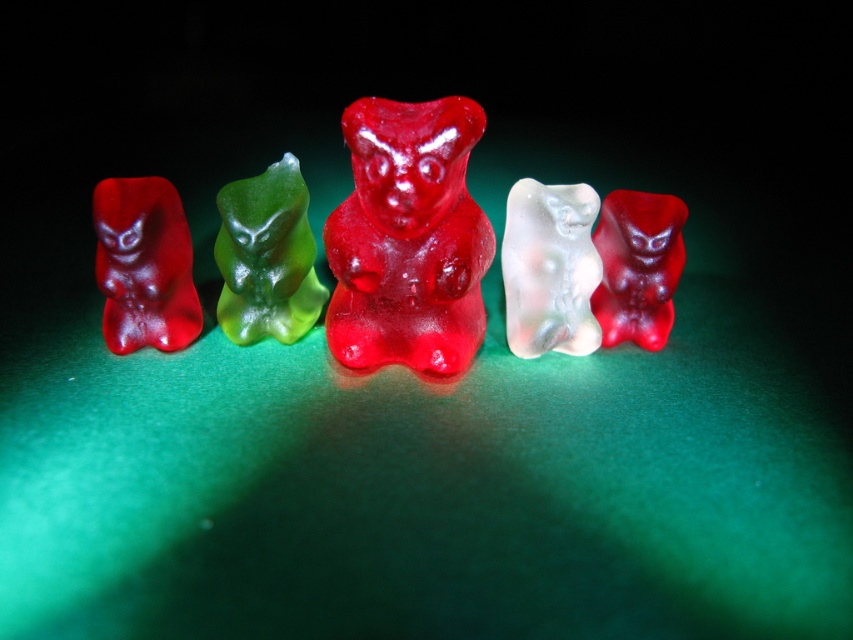
Question: Which object is positioned closest to the green translucent bear at center?

Choices:
 (A) translucent white bear at center
 (B) translucent red bear at center
 (C) matte red gummy bear at left
 (D) translucent red bear at right

Answer: (C)

Question: Which object appears farthest from the camera in this image?

Choices:
 (A) green translucent bear at center
 (B) translucent red bear at right
 (C) matte red gummy bear at left

Answer: (B)

Question: Is matte red gummy bear at left wider than translucent white bear at center?

Choices:
 (A) yes
 (B) no

Answer: (B)

Question: Is translucent red bear at center to the left of translucent red bear at right from the viewer's perspective?

Choices:
 (A) no
 (B) yes

Answer: (B)

Question: Which point is closer to the camera taking this photo?

Choices:
 (A) (503, 273)
 (B) (187, 308)
 (C) (631, 236)
 (D) (218, 198)

Answer: (D)

Question: Can you confirm if translucent red bear at center is smaller than translucent white bear at center?

Choices:
 (A) no
 (B) yes

Answer: (A)